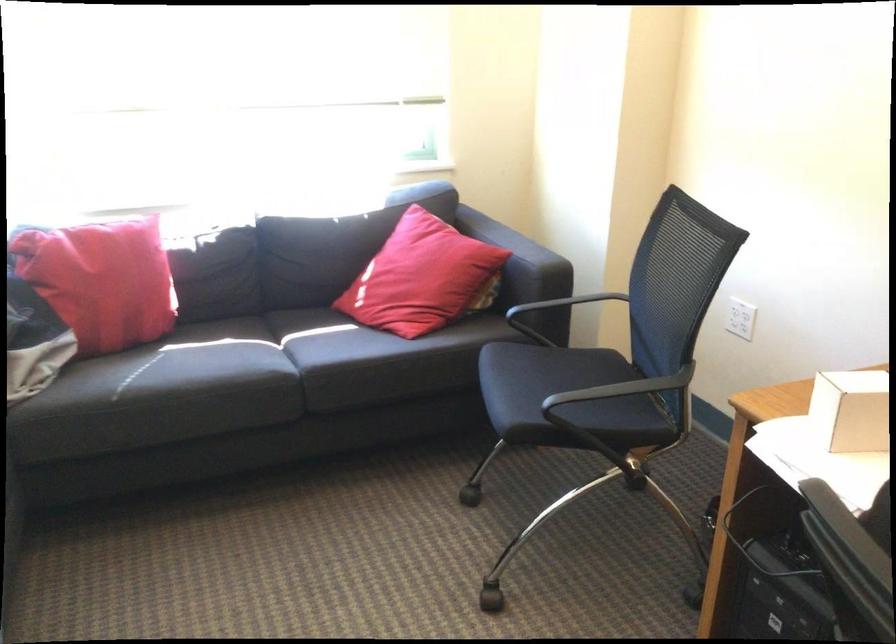
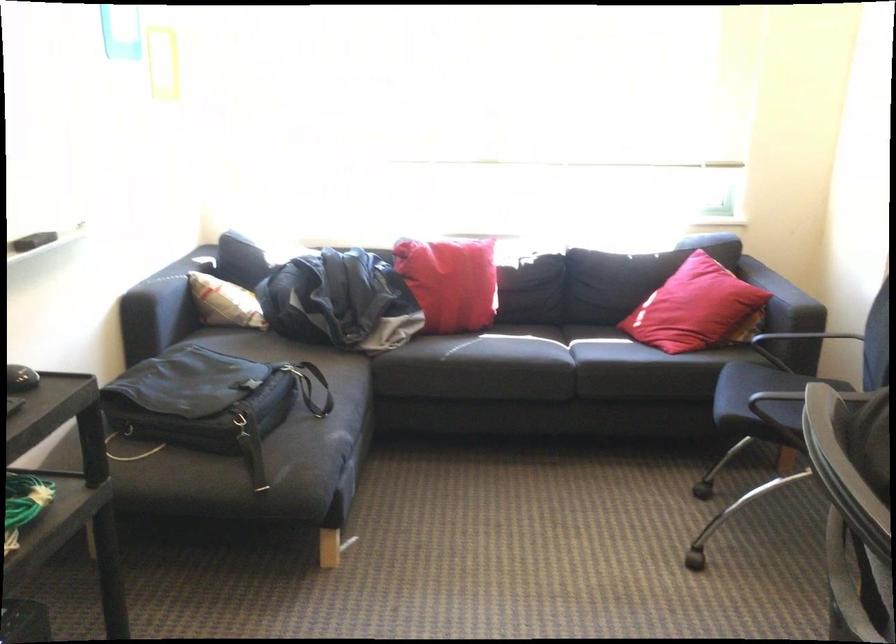
Find the pixel in the second image that matches point 421,281 in the first image.

(695, 308)